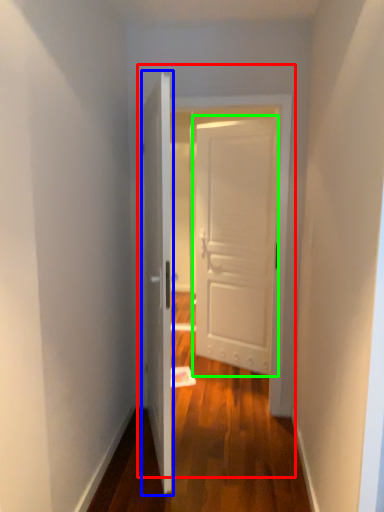
Question: Which object is positioned farthest from door (highlighted by a red box)? Select from door (highlighted by a blue box) and door (highlighted by a green box).

Choices:
 (A) door
 (B) door

Answer: (B)